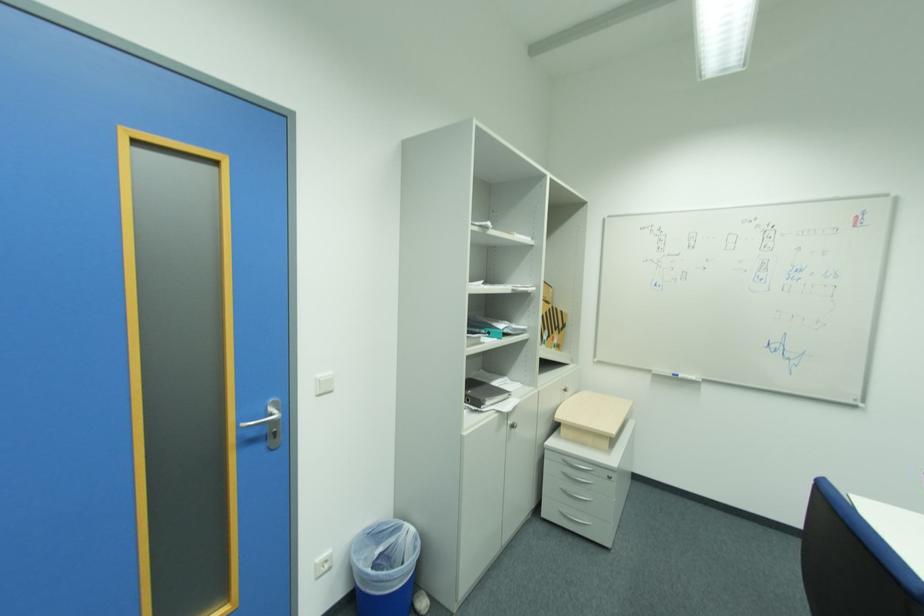
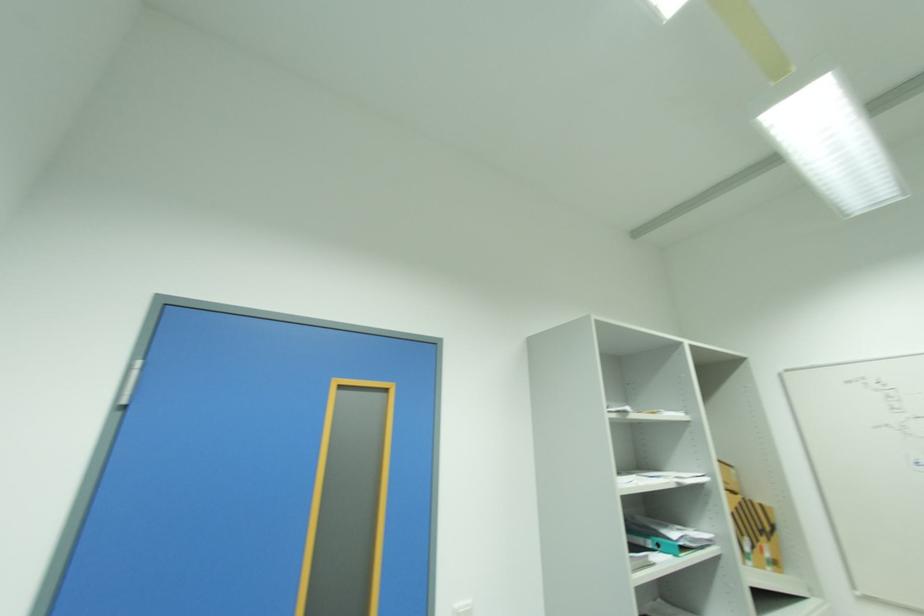
How did the camera likely rotate?

The camera's rotation is toward left-up.